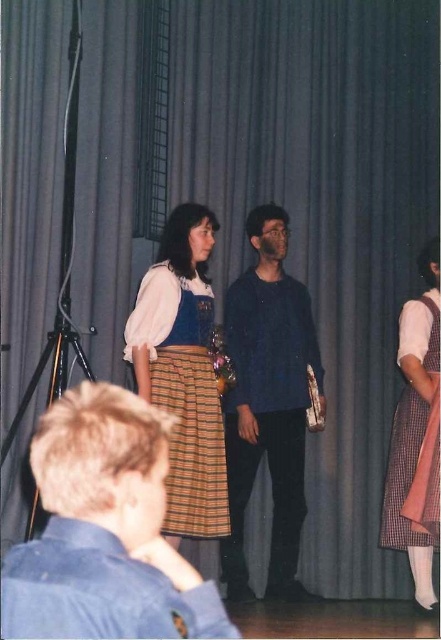
You are a photographer setting up for a school play. You need to position a spotlight so it can illuminate both the matte white blouse at center and the checkered fabric dress at right without overlapping. Given their widths, which garment requires a wider spotlight to cover its entire width?

The matte white blouse at center requires a wider spotlight because its width surpasses that of the checkered fabric dress at right.

You are a stagehand who needs to move a 3.5 feet wide equipment cart between the matte white blouse at center and the checkered fabric dress at right. Can you fit the cart through the space between them?

The distance between the matte white blouse at center and the checkered fabric dress at right is 3.80 feet, which is wider than the 3.5 feet width of the equipment cart. Therefore, the cart can fit through the space between them.